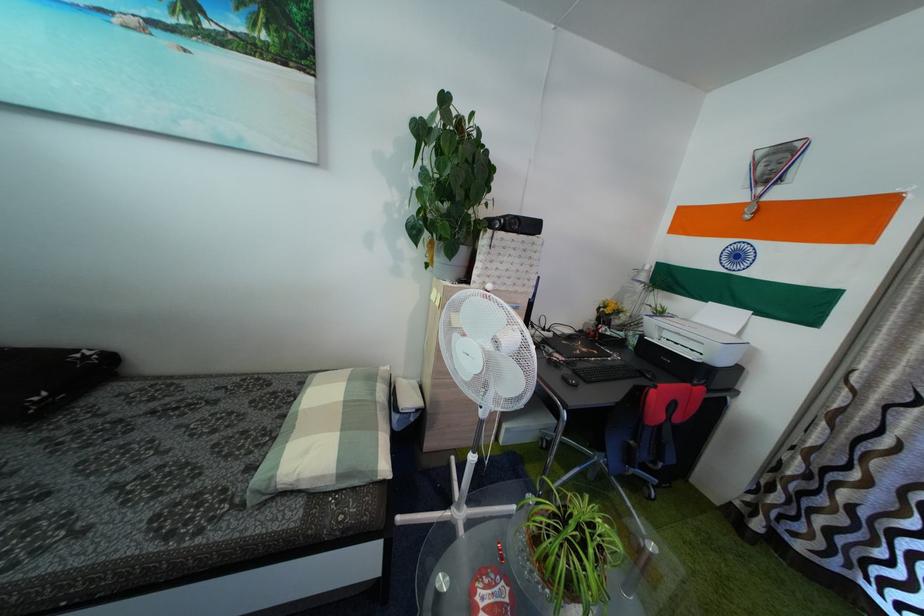
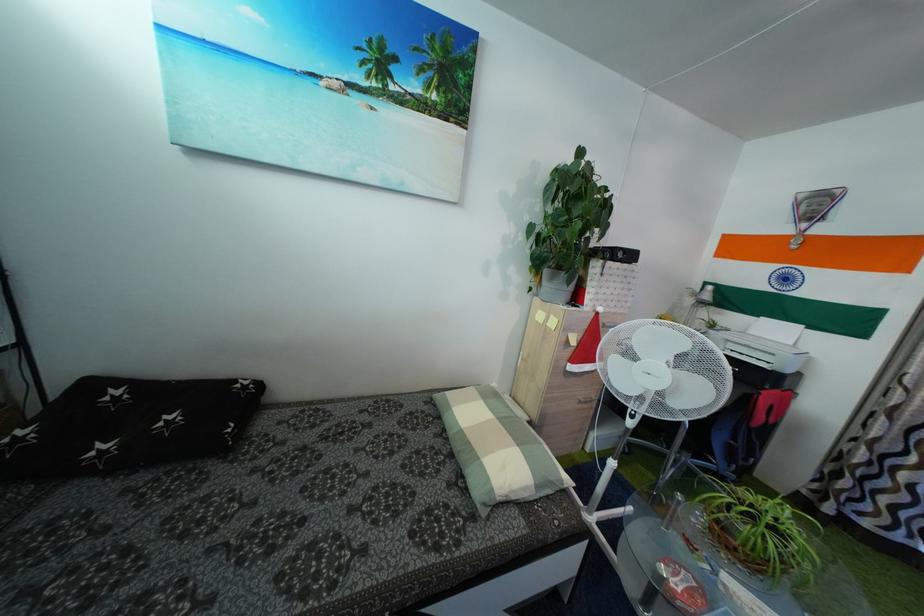
Question: What movement of the cameraman would produce the second image?

Choices:
 (A) Left
 (B) Right
 (C) Forward
 (D) Backward

Answer: (A)